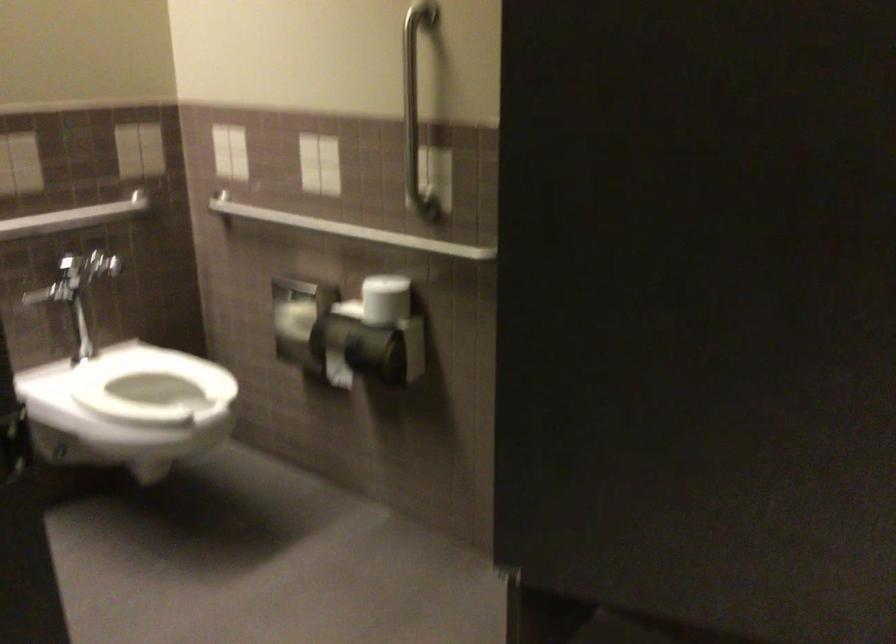
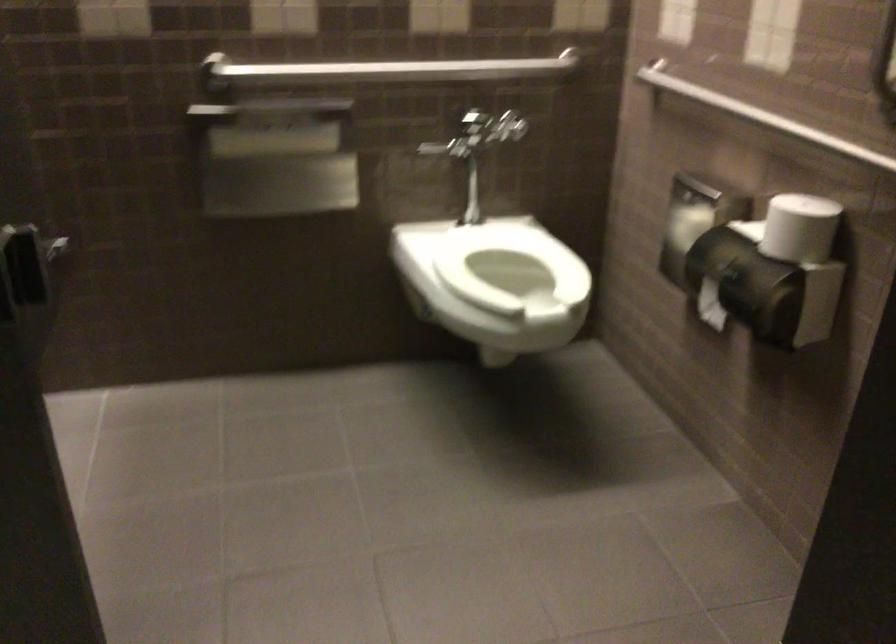
Find the pixel in the second image that matches [395,297] in the first image.

(799, 228)